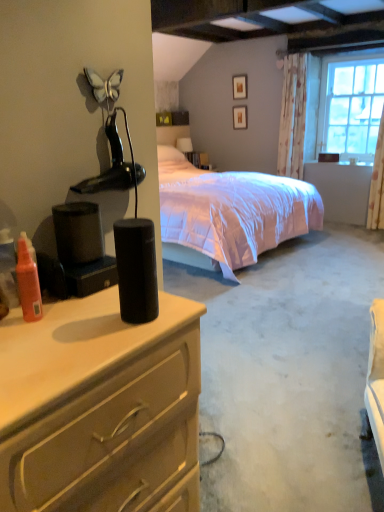
Find the location of `black matte lamp at upper left`. black matte lamp at upper left is located at coordinates (114, 165).

Measure the distance between point (288, 68) and camera.

5.87 meters.

What do you see at coordinates (96, 403) in the screenshot?
I see `matte black speaker at left` at bounding box center [96, 403].

The width and height of the screenshot is (384, 512). I want to click on clear glass window at upper right, so click(x=344, y=104).

You are a GUI agent. You are given a task and a screenshot of the screen. Output one action in this format:
    pyautogui.click(x=<x>, y=<y>)
    Task: Click on the black matte lamp at upper left
    The image size is (384, 512).
    Given the screenshot: What is the action you would take?
    pyautogui.click(x=114, y=165)

Does white floral fabric curtain at upper right have a lesser height compared to wooden picture frame at upper center, which is the second picture frame in top-to-bottom order?

Incorrect, the height of white floral fabric curtain at upper right does not fall short of that of wooden picture frame at upper center, which is the second picture frame in top-to-bottom order.

Considering the positions of points (294, 168) and (237, 106), is point (294, 168) closer to camera compared to point (237, 106)?

Yes.

Is white floral fabric curtain at upper right far away from wooden picture frame at upper center, the 1th picture frame in the bottom-to-top sequence?

No, there isn't a large distance between white floral fabric curtain at upper right and wooden picture frame at upper center, the 1th picture frame in the bottom-to-top sequence.

Is white floral fabric curtain at upper right thinner than wooden picture frame at upper center, the 1th picture frame in the bottom-to-top sequence?

In fact, white floral fabric curtain at upper right might be wider than wooden picture frame at upper center, the 1th picture frame in the bottom-to-top sequence.

From a real-world perspective, is matte black speaker at left positioned over black matte lamp at upper left based on gravity?

No.

Choose the correct answer: Is matte black speaker at left inside black matte lamp at upper left or outside it?

matte black speaker at left is not inside black matte lamp at upper left, it's outside.

Could you tell me if matte black speaker at left is facing black matte lamp at upper left?

No, matte black speaker at left is not oriented towards black matte lamp at upper left.

From the image's perspective, which is below, matte black speaker at left or black matte lamp at upper left?

From the image's view, matte black speaker at left is below.

Is wooden picture frame at upper center, the 1th picture frame in the bottom-to-top sequence, positioned far away from clear glass window at upper right?

Yes, wooden picture frame at upper center, the 1th picture frame in the bottom-to-top sequence, and clear glass window at upper right are quite far apart.

From a real-world perspective, is wooden picture frame at upper center, the 1th picture frame in the bottom-to-top sequence, located beneath clear glass window at upper right?

Yes, from a real-world perspective, wooden picture frame at upper center, the 1th picture frame in the bottom-to-top sequence, is under clear glass window at upper right.

Identify the location of window that is on the right side of wooden picture frame at upper center, the 1th picture frame in the bottom-to-top sequence. This screenshot has height=512, width=384. (344, 104).

Can you confirm if black matte lamp at upper left is smaller than matte black box at upper center?

Yes.

How many degrees apart are the facing directions of black matte lamp at upper left and matte black box at upper center?

black matte lamp at upper left and matte black box at upper center are facing 0.00112 degrees away from each other.

Which is closer, (118, 184) or (188, 123)?

Point (118, 184) is positioned closer to the camera compared to point (188, 123).

Between black matte lamp at upper left and matte black box at upper center, which one has larger width?

matte black box at upper center.

This screenshot has height=512, width=384. I want to click on lamp on the left of white floral fabric curtain at upper right, so click(114, 165).

Is white floral fabric curtain at upper right taller or shorter than black matte lamp at upper left?

Considering their sizes, white floral fabric curtain at upper right has more height than black matte lamp at upper left.

From the image's perspective, which one is positioned higher, white floral fabric curtain at upper right or black matte lamp at upper left?

white floral fabric curtain at upper right.

Between white floral fabric curtain at upper right and black matte lamp at upper left, which one appears on the left side from the viewer's perspective?

Positioned to the left is black matte lamp at upper left.

Does matte black speaker at left turn towards matte wooden picture frame at upper center, the first picture frame from the top?

No, matte black speaker at left is not aimed at matte wooden picture frame at upper center, the first picture frame from the top.

Between matte black speaker at left and matte wooden picture frame at upper center, the 2th picture frame ordered from the bottom, which one has smaller width?

With smaller width is matte wooden picture frame at upper center, the 2th picture frame ordered from the bottom.

Considering the positions of objects matte black speaker at left and matte wooden picture frame at upper center, the 2th picture frame ordered from the bottom, in the image provided, who is behind, matte black speaker at left or matte wooden picture frame at upper center, the 2th picture frame ordered from the bottom,?

matte wooden picture frame at upper center, the 2th picture frame ordered from the bottom, is further away from the camera.

Which point is more distant from viewer, (189, 421) or (236, 88)?

Point (236, 88)

Between matte wooden picture frame at upper center, the first picture frame from the top, and black matte speaker at center, which one has less height?

black matte speaker at center is shorter.

In the scene shown: From a real-world perspective, which is physically above, matte wooden picture frame at upper center, the 2th picture frame ordered from the bottom, or black matte speaker at center?

matte wooden picture frame at upper center, the 2th picture frame ordered from the bottom, from a real-world perspective.

Is matte wooden picture frame at upper center, the first picture frame from the top, thinner than black matte speaker at center?

Yes, matte wooden picture frame at upper center, the first picture frame from the top, is thinner than black matte speaker at center.

From the white floral fabric curtain at upper right, count 2nd picture frames backward and point to it. Please provide its 2D coordinates.

[(240, 117)]

The image size is (384, 512). Identify the location of lamp positioned vertically above the matte black speaker at left (from a real-world perspective). (114, 165).

Considering their positions, is translucent orange spray bottle at left positioned further to matte black speaker at left than wooden picture frame at upper center, which is the second picture frame in top-to-bottom order?

Among the two, wooden picture frame at upper center, which is the second picture frame in top-to-bottom order, is located further to matte black speaker at left.

Considering their positions, is white floral fabric curtain at upper right positioned closer to matte black box at upper center than matte black speaker at left?

Among the two, white floral fabric curtain at upper right is located nearer to matte black box at upper center.

Looking at the image, which one is located further to wooden picture frame at upper center, which is the second picture frame in top-to-bottom order, matte black speaker at left or black matte lamp at upper left?

The object further to wooden picture frame at upper center, which is the second picture frame in top-to-bottom order, is matte black speaker at left.

Based on their spatial positions, is translucent orange spray bottle at left or black matte lamp at upper left closer to clear glass window at upper right?

black matte lamp at upper left is positioned closer to the anchor clear glass window at upper right.

Based on their spatial positions, is white floral fabric curtain at upper right or clear glass window at upper right closer to black matte lamp at upper left?

white floral fabric curtain at upper right.

Considering their positions, is matte black box at upper center positioned closer to white floral fabric curtain at upper right than black matte speaker at center?

Among the two, matte black box at upper center is located nearer to white floral fabric curtain at upper right.

Estimate the real-world distances between objects in this image. Which object is closer to translucent orange spray bottle at left, clear glass window at upper right or white floral fabric curtain at upper right?

white floral fabric curtain at upper right is closer to translucent orange spray bottle at left.

Looking at the image, which one is located further to black matte lamp at upper left, clear glass window at upper right or matte wooden picture frame at upper center, the 2th picture frame ordered from the bottom?

matte wooden picture frame at upper center, the 2th picture frame ordered from the bottom, is further to black matte lamp at upper left.

Identify the location of bottle between black matte speaker at center and matte black speaker at left in the up-down direction. This screenshot has width=384, height=512. (28, 281).

What are the coordinates of `picture frame between black matte speaker at center and wooden picture frame at upper center, which is the second picture frame in top-to-bottom order, in the front-back direction` in the screenshot? It's located at (239, 86).

Locate an element on the screen. This screenshot has width=384, height=512. speaker positioned between matte black speaker at left and white floral fabric curtain at upper right from near to far is located at coordinates (136, 269).

Where is `bottle positioned between matte black speaker at left and white floral fabric curtain at upper right from near to far`? The width and height of the screenshot is (384, 512). bottle positioned between matte black speaker at left and white floral fabric curtain at upper right from near to far is located at coordinates (28, 281).